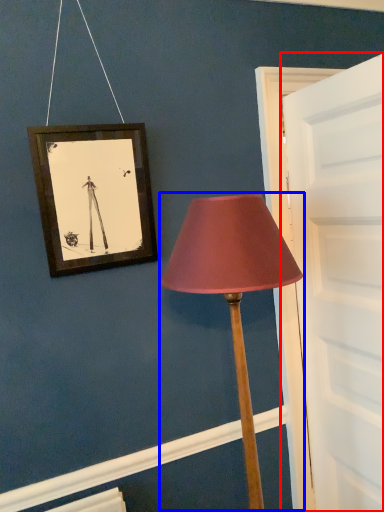
Question: Which of the following is the closest to the observer, door (highlighted by a red box) or lamp (highlighted by a blue box)?

Choices:
 (A) door
 (B) lamp

Answer: (B)